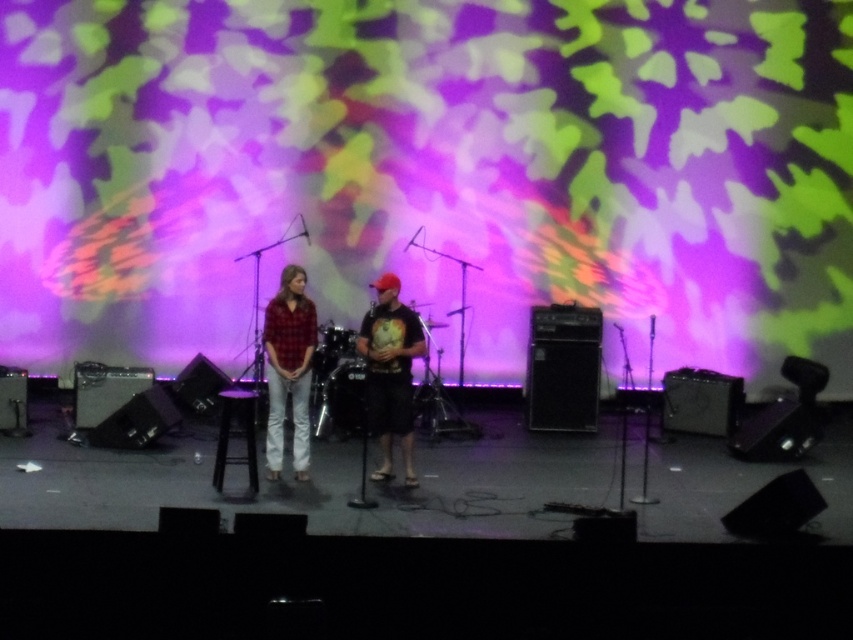
Question: Which of the following is the farthest from the observer?

Choices:
 (A) matte black t-shirt at center
 (B) plaid shirt at center

Answer: (B)

Question: Is matte black t-shirt at center wider than plaid shirt at center?

Choices:
 (A) yes
 (B) no

Answer: (A)

Question: Can you confirm if matte black t-shirt at center is positioned below plaid shirt at center?

Choices:
 (A) yes
 (B) no

Answer: (A)

Question: Is matte black t-shirt at center above plaid shirt at center?

Choices:
 (A) yes
 (B) no

Answer: (B)